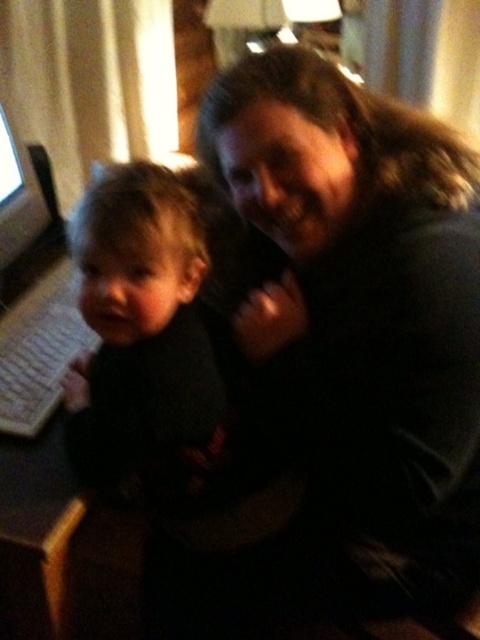
Is dark gray sweater at center to the right of dark matte clothing at center from the viewer's perspective?

Correct, you'll find dark gray sweater at center to the right of dark matte clothing at center.

Who is more distant from viewer, (x=371, y=323) or (x=112, y=308)?

The point (x=371, y=323) is more distant.

The height and width of the screenshot is (640, 480). I want to click on dark gray sweater at center, so click(362, 312).

Is dark matte clothing at center to the right of matte black monitor at left from the viewer's perspective?

Indeed, dark matte clothing at center is positioned on the right side of matte black monitor at left.

Does dark matte clothing at center have a larger size compared to matte black monitor at left?

Indeed, dark matte clothing at center has a larger size compared to matte black monitor at left.

Which is in front, point (120, 294) or point (3, 198)?

Point (120, 294) is in front.

Find the location of a particular element. This screenshot has width=480, height=640. dark matte clothing at center is located at coordinates (139, 323).

Is point (297, 109) more distant than point (20, 188)?

No, (297, 109) is closer to viewer.

Who is lower down, dark gray sweater at center or matte black monitor at left?

dark gray sweater at center

The height and width of the screenshot is (640, 480). In order to click on dark gray sweater at center in this screenshot , I will do `click(362, 312)`.